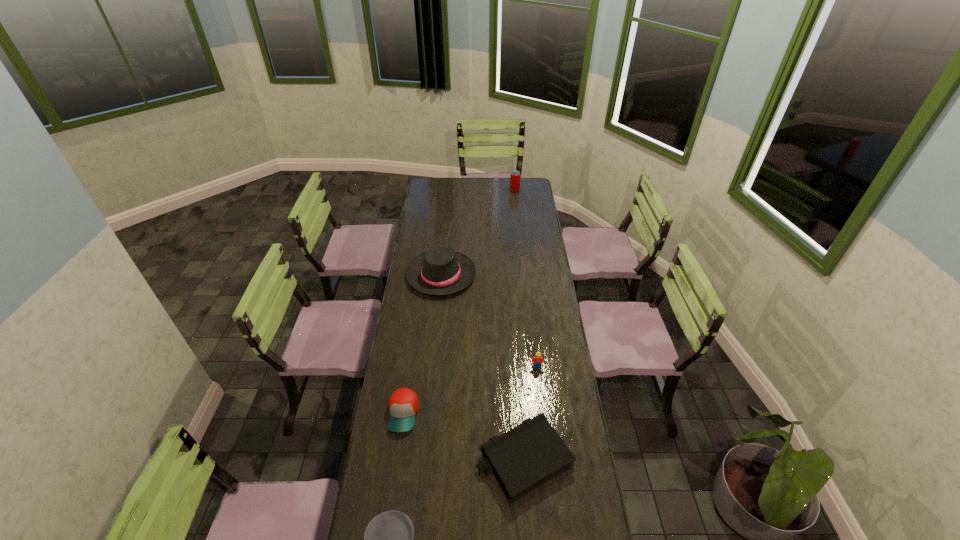
You are a GUI agent. You are given a task and a screenshot of the screen. Output one action in this format:
    pyautogui.click(x=<x>, y=<y>)
    Task: Click on the free region located 0.180m on the back of the Bible
    
    Given the screenshot: What is the action you would take?
    pyautogui.click(x=518, y=380)

Identify the location of object that is at the far edge. Image resolution: width=960 pixels, height=540 pixels. (515, 177).

Image resolution: width=960 pixels, height=540 pixels. I want to click on dress hat that is at the left edge, so click(441, 271).

Find the location of a particular element. baseball cap at the left edge is located at coordinates (403, 405).

The width and height of the screenshot is (960, 540). Identify the location of beer can located in the right edge section of the desktop. (515, 177).

Locate an element on the screen. This screenshot has width=960, height=540. Lego that is at the right edge is located at coordinates click(x=537, y=359).

Find the location of a particular element. Bible present at the right edge is located at coordinates (525, 457).

At what (x,y) coordinates should I click in order to perform the action: click on object at the far right corner. Please return your answer as a coordinate pair (x, y). This screenshot has width=960, height=540. Looking at the image, I should click on (515, 177).

Find the location of `vacant space at the far edge of the desktop`. vacant space at the far edge of the desktop is located at coordinates (493, 187).

In the image, there is a desktop. Find the location of `vacant space at the left edge`. vacant space at the left edge is located at coordinates (421, 387).